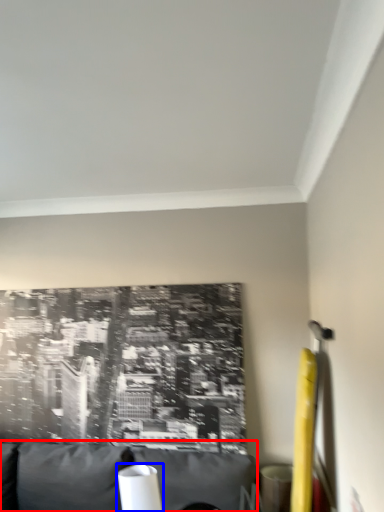
Question: Which point is closer to the camera, furniture (highlighted by a red box) or table lamp (highlighted by a blue box)?

Choices:
 (A) furniture
 (B) table lamp

Answer: (A)